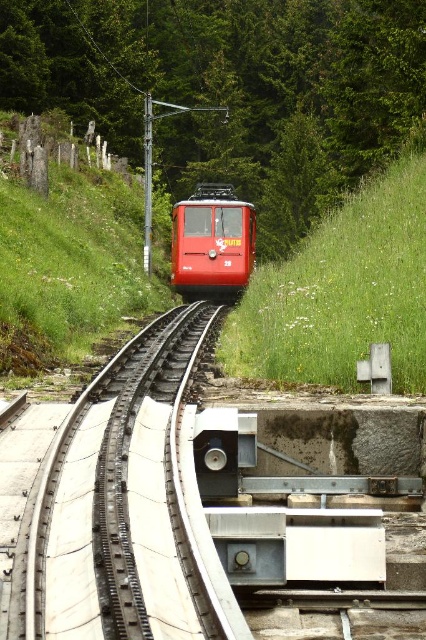
Question: Does metallic gray train track at center have a larger size compared to green grass at center?

Choices:
 (A) no
 (B) yes

Answer: (A)

Question: Which point is farther from the camera taking this photo?

Choices:
 (A) (229, 276)
 (B) (399, 196)
 (C) (126, 456)

Answer: (A)

Question: In this image, where is metallic gray train track at center located relative to shiny red train at center?

Choices:
 (A) above
 (B) below

Answer: (B)

Question: Which point is closer to the camera?

Choices:
 (A) shiny red train at center
 (B) metallic gray train track at center
 (C) green grass at center

Answer: (B)

Question: Which of the following is the closest to the observer?

Choices:
 (A) metallic gray train track at center
 (B) shiny red train at center
 (C) green grass at center

Answer: (A)

Question: Is metallic gray train track at center positioned at the back of shiny red train at center?

Choices:
 (A) no
 (B) yes

Answer: (A)